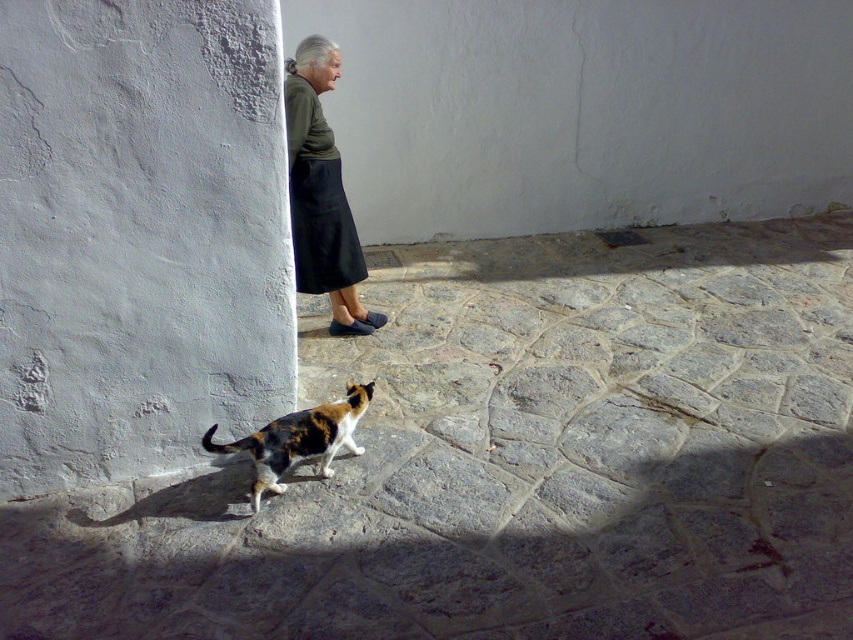
Question: Estimate the real-world distances between objects in this image. Which object is closer to the calico cat at lower center?

Choices:
 (A) white rough concrete pillar at lower left
 (B) dark green fabric skirt at upper center

Answer: (A)

Question: Which object is closer to the camera taking this photo?

Choices:
 (A) dark green fabric skirt at upper center
 (B) white rough concrete pillar at lower left

Answer: (B)

Question: From the image, what is the correct spatial relationship of calico cat at lower center in relation to dark green fabric skirt at upper center?

Choices:
 (A) right
 (B) left

Answer: (A)

Question: Observing the image, what is the correct spatial positioning of calico cat at lower center in reference to dark green fabric skirt at upper center?

Choices:
 (A) above
 (B) below

Answer: (B)

Question: Which point is closer to the camera?

Choices:
 (A) (144, 602)
 (B) (306, 122)

Answer: (A)

Question: Does dark green fabric skirt at upper center come in front of calico fur cat at lower center?

Choices:
 (A) yes
 (B) no

Answer: (B)